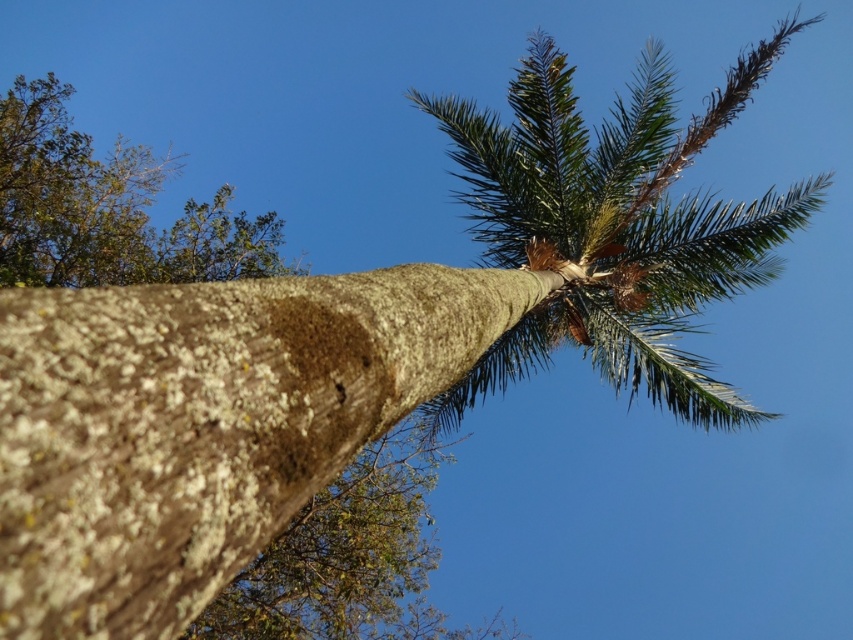
Question: Among these objects, which one is nearest to the camera?

Choices:
 (A) green leafy tree at upper left
 (B) brown rough bark at center

Answer: (B)

Question: Is brown rough bark at center to the right of green leafy tree at upper left from the viewer's perspective?

Choices:
 (A) yes
 (B) no

Answer: (A)

Question: Can you confirm if brown rough bark at center is thinner than green leafy tree at upper left?

Choices:
 (A) yes
 (B) no

Answer: (B)

Question: Is brown rough bark at center positioned behind green leafy tree at upper left?

Choices:
 (A) yes
 (B) no

Answer: (B)